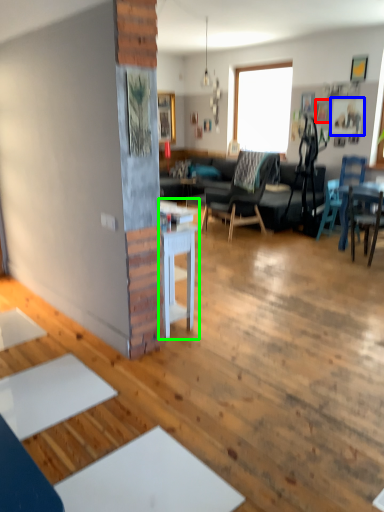
Question: Based on their relative distances, which object is farther from picture frame (highlighted by a red box)? Choose from picture frame (highlighted by a blue box) and table (highlighted by a green box).

Choices:
 (A) picture frame
 (B) table

Answer: (B)